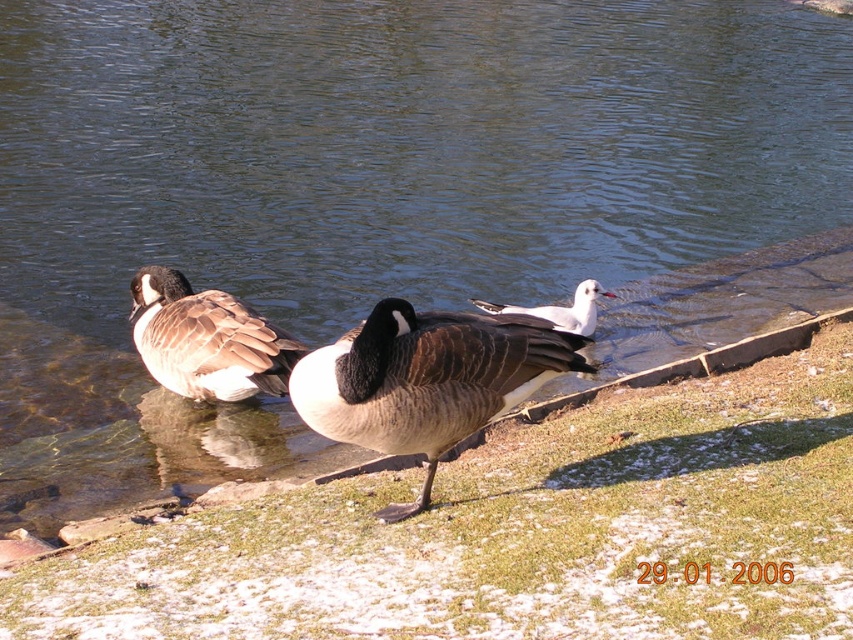
Is green grass at center thinner than dark brown feathered duck at center?

Incorrect, green grass at center's width is not less than dark brown feathered duck at center's.

Is point (779, 456) more distant than point (462, 362)?

Yes, it is.

The image size is (853, 640). In order to click on green grass at center in this screenshot , I will do `click(514, 529)`.

Does point (212, 356) come behind point (578, 308)?

No.

Looking at this image, can you confirm if brown feathered goose at center is wider than white glossy bird at center?

Correct, the width of brown feathered goose at center exceeds that of white glossy bird at center.

Is point (194, 340) positioned before point (589, 314)?

Yes.

Find the location of `brown feathered goose at center`. brown feathered goose at center is located at coordinates (x=206, y=339).

Measure the distance from green grass at center to white glossy bird at center.

green grass at center is 2.57 meters away from white glossy bird at center.

Does green grass at center appear over white glossy bird at center?

No.

Where is `green grass at center`? This screenshot has height=640, width=853. green grass at center is located at coordinates (514, 529).

Find the location of a particular element. Image resolution: width=853 pixels, height=640 pixels. green grass at center is located at coordinates (514, 529).